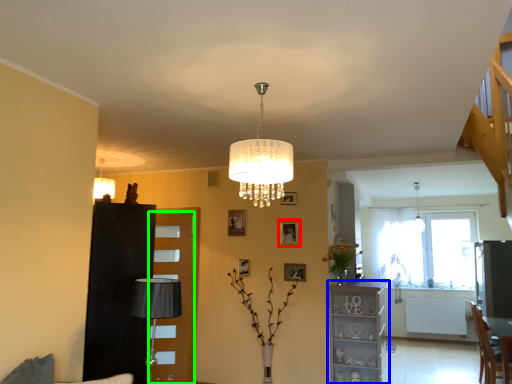
Question: Considering the real-world distances, which object is farthest from picture frame (highlighted by a red box)? furniture (highlighted by a blue box) or glass door (highlighted by a green box)?

Choices:
 (A) furniture
 (B) glass door

Answer: (B)